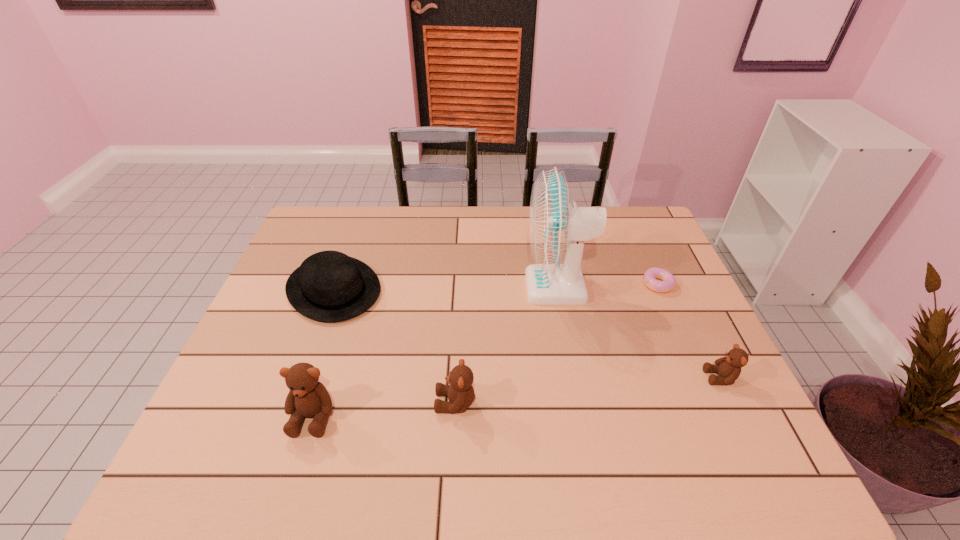
This screenshot has width=960, height=540. In order to click on empty location between the shortest object and the fedora in this screenshot , I will do `click(496, 287)`.

Where is `empty space that is in between the leftmost teddy bear and the second tallest teddy bear`? The image size is (960, 540). empty space that is in between the leftmost teddy bear and the second tallest teddy bear is located at coordinates (384, 409).

Where is `vacant area that lies between the leftmost teddy bear and the doughnut`? This screenshot has width=960, height=540. vacant area that lies between the leftmost teddy bear and the doughnut is located at coordinates (486, 350).

Locate an element on the screen. free spot between the shortest teddy bear and the second shortest teddy bear is located at coordinates (588, 390).

Locate an element on the screen. This screenshot has height=540, width=960. vacant space in between the fedora and the fifth shortest object is located at coordinates (324, 353).

Image resolution: width=960 pixels, height=540 pixels. Find the location of `free point between the fifth shortest object and the shortest object`. free point between the fifth shortest object and the shortest object is located at coordinates (486, 350).

Find the location of a particular element. vacant area that lies between the second teddy bear from left to right and the shortest teddy bear is located at coordinates click(x=588, y=390).

Where is `free space between the doughnut and the rightmost teddy bear`? The width and height of the screenshot is (960, 540). free space between the doughnut and the rightmost teddy bear is located at coordinates (689, 331).

I want to click on object identified as the fourth closest to the second tallest teddy bear, so click(728, 368).

Identify which object is located as the third nearest to the fedora. Please provide its 2D coordinates. Your answer should be formatted as a tuple, i.e. [(x, y)], where the tuple contains the x and y coordinates of a point satisfying the conditions above.

[(557, 231)]